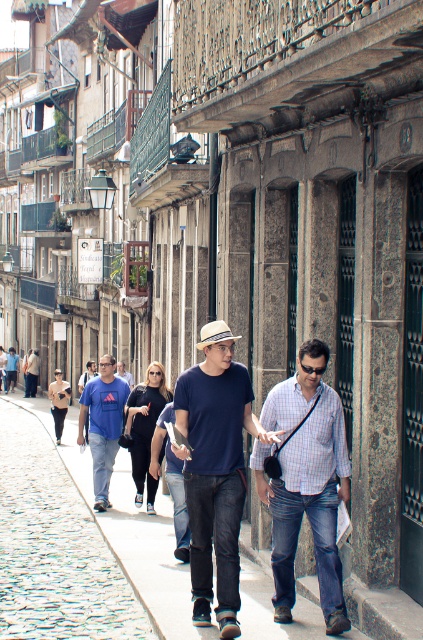
You are a photographer standing at the edge of the street. You want to take a photo that includes both the matte blue shirt at center and the cobblestone pavement at center. Which object should you focus on first if you want the smaller one to be in sharp focus?

The matte blue shirt at center has a smaller size compared to cobblestone pavement at center. Therefore, you should focus on the matte blue shirt at center first to ensure it is in sharp focus.

You are standing at the point with coordinates point (238, 337) and want to walk towards the point with coordinates point (348, 492). Which direction should you move to reach your destination?

You should move forward because point (348, 492) is in front of point (238, 337).